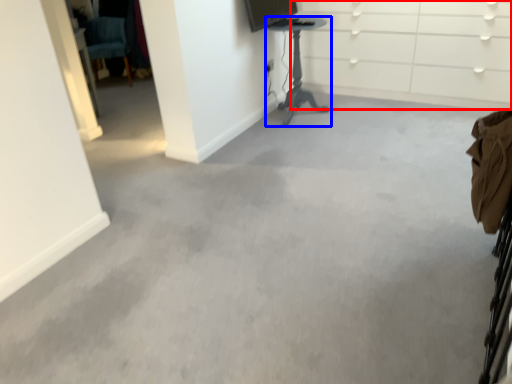
Question: Which object is closer to the camera taking this photo, dresser (highlighted by a red box) or furniture (highlighted by a blue box)?

Choices:
 (A) dresser
 (B) furniture

Answer: (A)